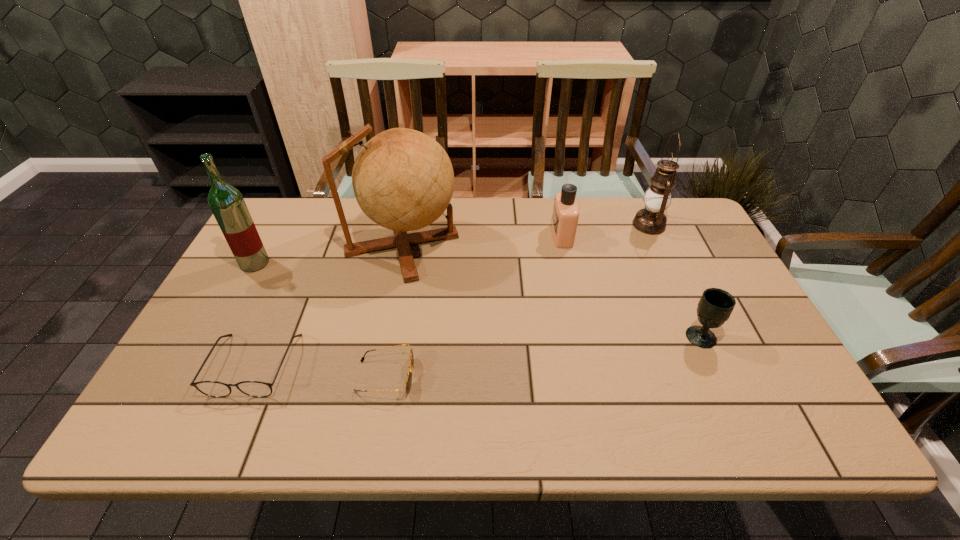
You are a GUI agent. You are given a task and a screenshot of the screen. Output one action in this format:
    pyautogui.click(x=<x>, y=<y>)
    Task: Click on the vacant space situated on the right of the liquor
    
    Given the screenshot: What is the action you would take?
    pyautogui.click(x=337, y=263)

This screenshot has height=540, width=960. Find the location of `free region located on the left of the oil lamp`. free region located on the left of the oil lamp is located at coordinates (592, 225).

You are a GUI agent. You are given a task and a screenshot of the screen. Output one action in this format:
    pyautogui.click(x=<x>, y=<y>)
    Task: Click on the vacant region located on the front label of the third object from right to left
    
    Given the screenshot: What is the action you would take?
    pyautogui.click(x=450, y=235)

You are a GUI agent. You are given a task and a screenshot of the screen. Output one action in this format:
    pyautogui.click(x=<x>, y=<y>)
    Task: Click on the vacant area situated 0.110m on the front label of the third object from right to left
    This screenshot has width=960, height=540.
    Given the screenshot: What is the action you would take?
    pyautogui.click(x=516, y=235)

The image size is (960, 540). I want to click on vacant area situated on the front label of the third object from right to left, so click(x=479, y=235).

Identify the location of free space located on the back of the third shortest object. The width and height of the screenshot is (960, 540). (664, 256).

Locate an element on the screen. This screenshot has height=540, width=960. blank space located on the lenses of the sunglasses is located at coordinates (510, 376).

Identify the location of globe located in the far edge section of the desktop. (403, 180).

Image resolution: width=960 pixels, height=540 pixels. What are the coordinates of `oil lamp that is at the far edge` in the screenshot? It's located at (651, 220).

Where is `perfume at the far edge`? perfume at the far edge is located at coordinates (565, 216).